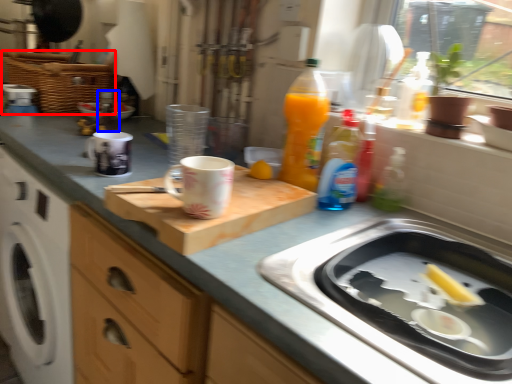
Question: Which of the following is the closest to the observer, basket (highlighted by a red box) or bottle (highlighted by a blue box)?

Choices:
 (A) basket
 (B) bottle

Answer: (B)